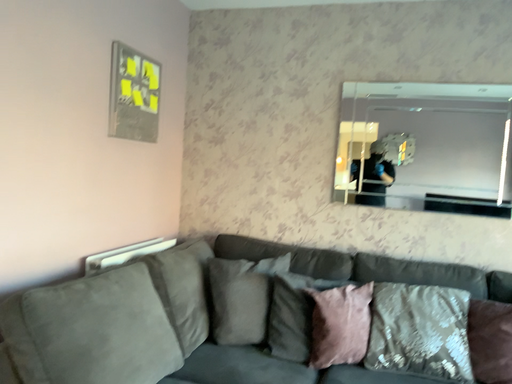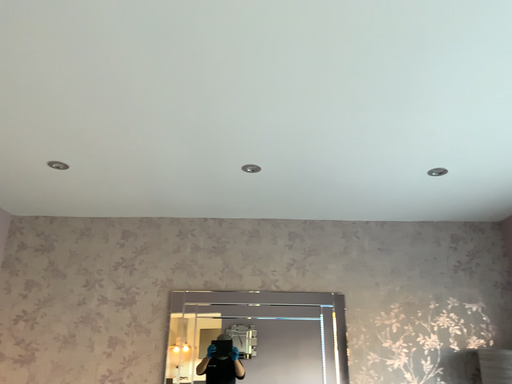
Question: How did the camera likely rotate when shooting the video?

Choices:
 (A) rotated downward
 (B) rotated upward

Answer: (B)